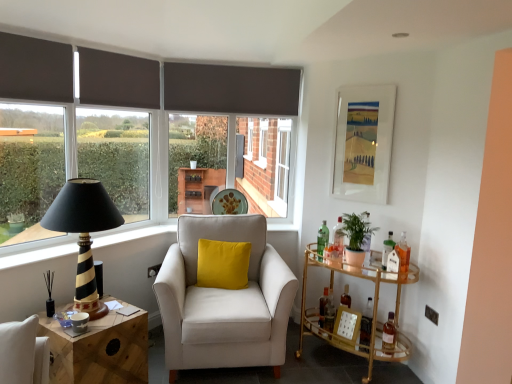
Question: Is gold glass bar cart at right, the second table from the left, looking in the opposite direction of metallic silver power outlet at lower right?

Choices:
 (A) yes
 (B) no

Answer: (B)

Question: Can you confirm if gold glass bar cart at right, the second table from the left, is taller than metallic silver power outlet at lower right?

Choices:
 (A) yes
 (B) no

Answer: (A)

Question: Is gold glass bar cart at right, the second table from the left, completely or partially outside of metallic silver power outlet at lower right?

Choices:
 (A) yes
 (B) no

Answer: (A)

Question: From the image's perspective, does gold glass bar cart at right, the 1th table when ordered from right to left, appear higher than metallic silver power outlet at lower right?

Choices:
 (A) yes
 (B) no

Answer: (B)

Question: Is metallic silver power outlet at lower right inside gold glass bar cart at right, the 1th table when ordered from right to left?

Choices:
 (A) no
 (B) yes

Answer: (A)

Question: Is white matte picture frame at upper right, marked as the 2th picture frame in a bottom-to-top arrangement, spatially inside black fabric window screen at left, or outside of it?

Choices:
 (A) inside
 (B) outside

Answer: (B)

Question: Considering the positions of white matte picture frame at upper right, which is the first picture frame in top-to-bottom order, and black fabric window screen at left in the image, is white matte picture frame at upper right, which is the first picture frame in top-to-bottom order, bigger or smaller than black fabric window screen at left?

Choices:
 (A) big
 (B) small

Answer: (B)

Question: From a real-world perspective, relative to black fabric window screen at left, is white matte picture frame at upper right, marked as the 2th picture frame in a bottom-to-top arrangement, vertically above or below?

Choices:
 (A) below
 (B) above

Answer: (B)

Question: Considering the positions of point coord(333,155) and point coord(4,134), is point coord(333,155) closer or farther from the camera than point coord(4,134)?

Choices:
 (A) closer
 (B) farther

Answer: (B)

Question: Is green leafy plant at right bigger or smaller than velvet yellow pillow at center?

Choices:
 (A) big
 (B) small

Answer: (B)

Question: Is green leafy plant at right wider or thinner than velvet yellow pillow at center?

Choices:
 (A) thin
 (B) wide

Answer: (B)

Question: From the image's perspective, is green leafy plant at right located above or below velvet yellow pillow at center?

Choices:
 (A) below
 (B) above

Answer: (B)

Question: From a real-world perspective, relative to velvet yellow pillow at center, is green leafy plant at right vertically above or below?

Choices:
 (A) below
 (B) above

Answer: (B)

Question: From a real-world perspective, is green leafy plant at right physically located above or below dark grey fabric curtain at upper left, the second curtain viewed from the back?

Choices:
 (A) below
 (B) above

Answer: (A)

Question: Is point (347, 228) positioned closer to the camera than point (22, 57)?

Choices:
 (A) closer
 (B) farther

Answer: (B)